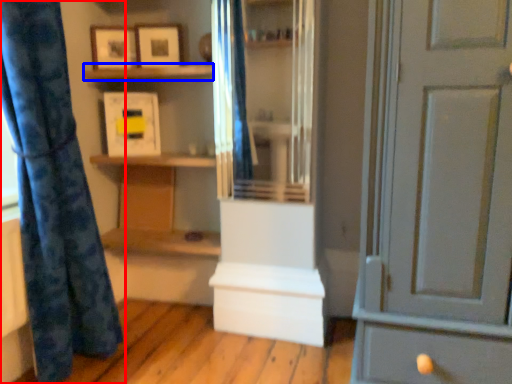
Question: Which point is closer to the camera, curtain (highlighted by a red box) or shelf (highlighted by a blue box)?

Choices:
 (A) curtain
 (B) shelf

Answer: (A)